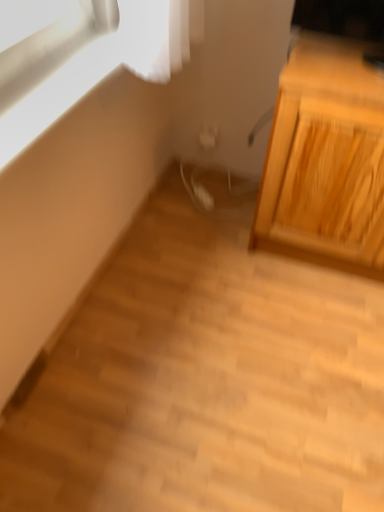
Find the location of a particular element. This screenshot has height=512, width=384. free point above matte white window at upper left (from a real-world perspective) is located at coordinates (73, 76).